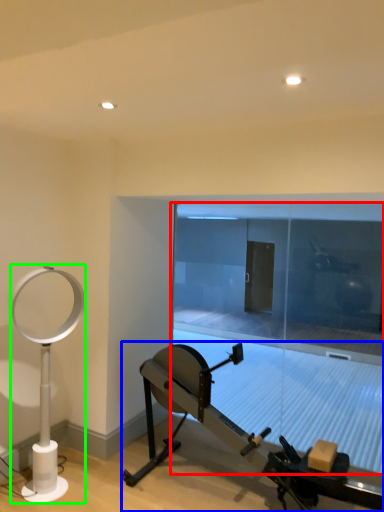
Question: Which is nearer to the glass door (highlighted by a red box)? stationary bicycle (highlighted by a blue box) or table lamp (highlighted by a green box).

Choices:
 (A) stationary bicycle
 (B) table lamp

Answer: (A)